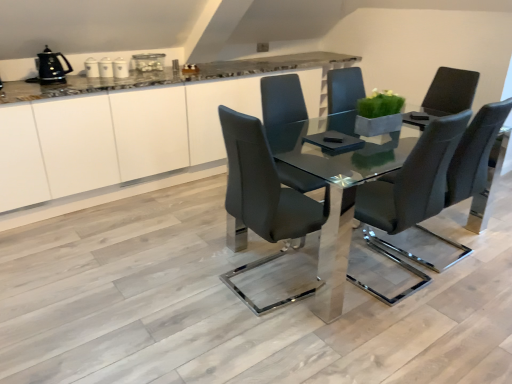
This screenshot has height=384, width=512. Find the location of `free space in front of clear glass table at center`. free space in front of clear glass table at center is located at coordinates (368, 335).